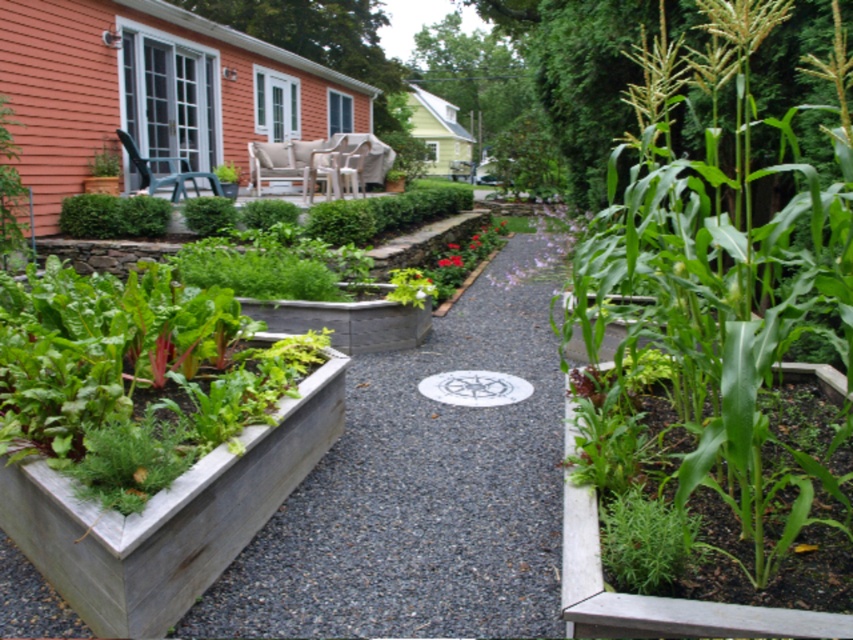
From the picture: You are a gardener who wants to place a new small statue that is 1 foot tall between the smooth gray planter at lower left and the green leafy plant at center. Considering their heights, which object will the statue be taller than?

The smooth gray planter at lower left is much taller than the green leafy plant at center. Since the statue is 1 foot tall, it will be taller than the green leafy plant at center but shorter than the smooth gray planter at lower left.

From the picture: You are a gardener who wants to place a new small herb pot between the smooth gray planter at lower left and the green leafy plant at center. Based on their sizes, which object should you place the herb pot closer to?

Since the smooth gray planter at lower left is larger than the green leafy plant at center, you should place the herb pot closer to the green leafy plant at center to avoid overcrowding.